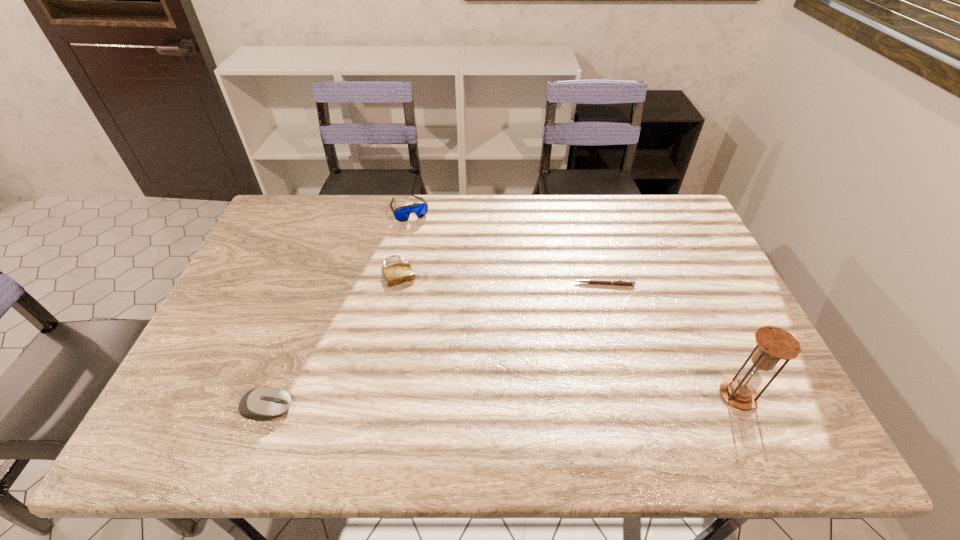
Locate an element on the screen. The height and width of the screenshot is (540, 960). object positioned at the far edge is located at coordinates (402, 213).

Locate an element on the screen. This screenshot has height=540, width=960. computer equipment positioned at the near edge is located at coordinates (265, 402).

Where is `hourglass that is at the near edge`? hourglass that is at the near edge is located at coordinates (773, 343).

Locate an element on the screen. The image size is (960, 540). object that is at the right edge is located at coordinates (773, 343).

Image resolution: width=960 pixels, height=540 pixels. What are the coordinates of `object present at the near right corner` in the screenshot? It's located at (773, 343).

In the image, there is a desktop. Where is `vacant space at the far edge`? The image size is (960, 540). vacant space at the far edge is located at coordinates (400, 205).

This screenshot has width=960, height=540. I want to click on free space at the left edge, so click(x=282, y=254).

Find the location of `vacant space at the right edge`. vacant space at the right edge is located at coordinates tap(705, 259).

Where is `vacant space at the far left corner of the desktop`? The image size is (960, 540). vacant space at the far left corner of the desktop is located at coordinates (291, 207).

The width and height of the screenshot is (960, 540). I want to click on vacant area between the fourth tallest object and the sunglasses, so click(x=405, y=240).